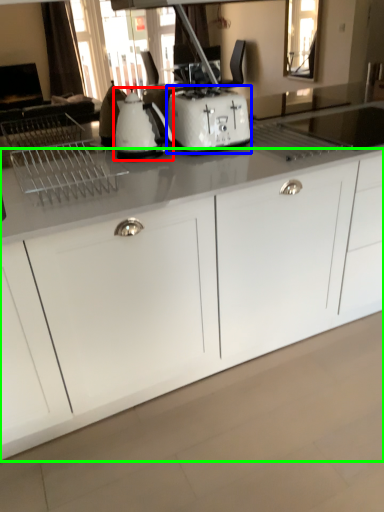
Question: Which is farther away from kitchen appliance (highlighted by a red box)? toaster (highlighted by a blue box) or cabinetry (highlighted by a green box)?

Choices:
 (A) toaster
 (B) cabinetry

Answer: (B)